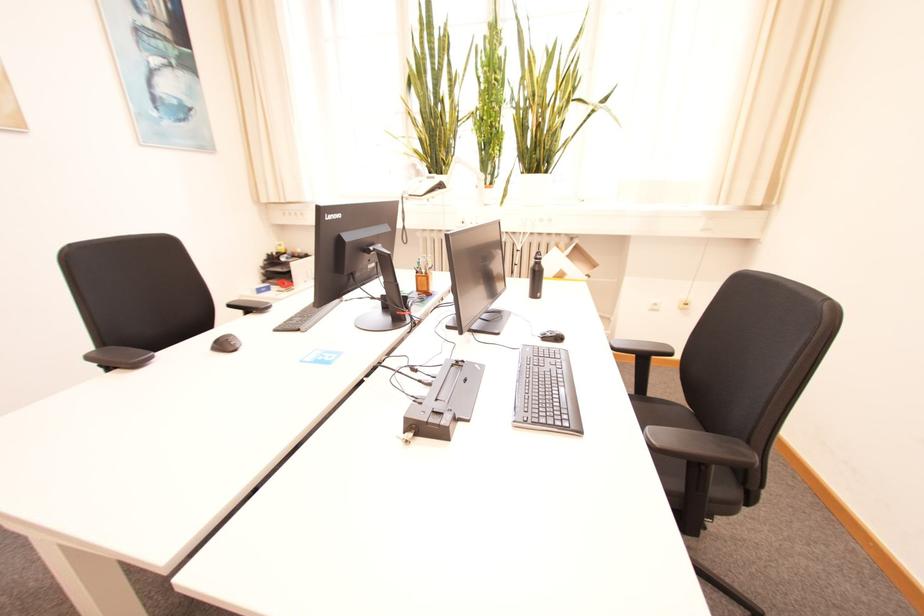
Locate an element on the screen. This screenshot has width=924, height=616. docking station lock is located at coordinates (407, 435).